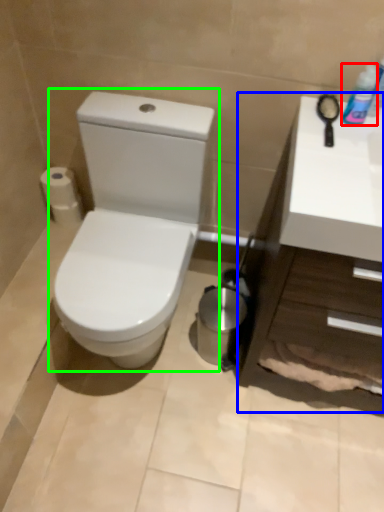
Question: Estimate the real-world distances between objects in this image. Which object is farther from mouthwash (highlighted by a red box), counter top (highlighted by a blue box) or toilet (highlighted by a green box)?

Choices:
 (A) counter top
 (B) toilet

Answer: (B)